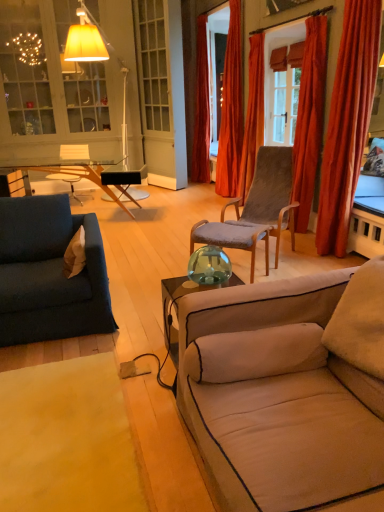
Find the location of `beige carpet at lower left`. beige carpet at lower left is located at coordinates (67, 439).

At what (x,y) coordinates should I click in order to perform the action: click on beige fabric pillow at left. Please return your answer as a coordinate pair (x, y). The width and height of the screenshot is (384, 512). Looking at the image, I should click on (75, 254).

Locate an element on the screen. velvet orange curtain at right, marked as the fifth curtain in a back-to-front arrangement is located at coordinates (348, 123).

Measure the distance between orange velvet curtain at center, which is the third curtain in front-to-back order, and camera.

They are 16.92 feet apart.

What do you see at coordinates (253, 115) in the screenshot? I see `orange velvet curtain at center, which is the third curtain in front-to-back order` at bounding box center [253, 115].

Find the location of a particular element. Image resolution: width=384 pixels, height=512 pixels. velvet orange curtain at upper right, which ranks as the fourth curtain in front-to-back order is located at coordinates (231, 110).

Locate an element on the screen. Image resolution: width=384 pixels, height=512 pixels. matte glass cabinet at upper left is located at coordinates (48, 73).

Considering the relative sizes of velvet orange curtain at upper right, arranged as the second curtain when viewed from the back, and velvet orange curtain at upper right, which is the fourth curtain from back to front, in the image provided, is velvet orange curtain at upper right, arranged as the second curtain when viewed from the back, taller than velvet orange curtain at upper right, which is the fourth curtain from back to front,?

Yes, velvet orange curtain at upper right, arranged as the second curtain when viewed from the back, is taller than velvet orange curtain at upper right, which is the fourth curtain from back to front.

Is velvet orange curtain at upper right, the 2th curtain positioned from the front, completely or partially inside velvet orange curtain at upper right, which ranks as the fourth curtain in front-to-back order?

Actually, velvet orange curtain at upper right, the 2th curtain positioned from the front, is outside velvet orange curtain at upper right, which ranks as the fourth curtain in front-to-back order.

Is velvet orange curtain at upper right, arranged as the second curtain when viewed from the back, next to velvet orange curtain at upper right, the 2th curtain positioned from the front, and touching it?

velvet orange curtain at upper right, arranged as the second curtain when viewed from the back, is not next to velvet orange curtain at upper right, the 2th curtain positioned from the front, and they're not touching.

How many degrees apart are the facing directions of velvet orange curtain at upper right, arranged as the second curtain when viewed from the back, and velvet orange curtain at upper right, which is the fourth curtain from back to front?

The angle between the facing direction of velvet orange curtain at upper right, arranged as the second curtain when viewed from the back, and the facing direction of velvet orange curtain at upper right, which is the fourth curtain from back to front, is 0.418 degrees.

Between beige fabric couch at lower right, which is the 1th studio couch from right to left, and velvet brown chair at center, which one has smaller width?

velvet brown chair at center is thinner.

Who is taller, beige fabric couch at lower right, which is the 1th studio couch from right to left, or velvet brown chair at center?

velvet brown chair at center is taller.

Who is bigger, beige fabric couch at lower right, acting as the second studio couch starting from the left, or velvet brown chair at center?

beige fabric couch at lower right, acting as the second studio couch starting from the left, is bigger.

Considering the positions of point (337, 407) and point (259, 234), is point (337, 407) closer or farther from the camera than point (259, 234)?

Point (337, 407) appears to be closer to the viewer than point (259, 234).

Between point (321, 65) and point (94, 182), which one is positioned in front?

Point (321, 65)

Is velvet orange curtain at upper right, which is the fourth curtain from back to front, positioned before wooden glass table at left?

Yes, the depth of velvet orange curtain at upper right, which is the fourth curtain from back to front, is less than that of wooden glass table at left.

Could you tell me if velvet orange curtain at upper right, the 2th curtain positioned from the front, is turned towards wooden glass table at left?

No, velvet orange curtain at upper right, the 2th curtain positioned from the front, is not turned towards wooden glass table at left.

Is velvet orange curtain at upper right, which is the fourth curtain from back to front, inside the boundaries of wooden glass table at left, or outside?

velvet orange curtain at upper right, which is the fourth curtain from back to front, exists outside the volume of wooden glass table at left.

Is velvet brown chair at center bigger or smaller than matte glass cabinet at upper left?

Clearly, velvet brown chair at center is smaller in size than matte glass cabinet at upper left.

Between velvet brown chair at center and matte glass cabinet at upper left, which one appears on the right side from the viewer's perspective?

From the viewer's perspective, velvet brown chair at center appears more on the right side.

Is the position of velvet brown chair at center more distant than that of matte glass cabinet at upper left?

No, the depth of velvet brown chair at center is less than that of matte glass cabinet at upper left.

Is velvet brown chair at center facing towards matte glass cabinet at upper left?

No, velvet brown chair at center is not turned towards matte glass cabinet at upper left.

Between wooden glass table at left and velvet orange curtain at right, marked as the fifth curtain in a back-to-front arrangement, which one has smaller width?

velvet orange curtain at right, marked as the fifth curtain in a back-to-front arrangement.

Is velvet orange curtain at right, marked as the fifth curtain in a back-to-front arrangement, at the back of wooden glass table at left?

No.

Does point (121, 204) come in front of point (347, 178)?

No, (121, 204) is further to viewer.

Can you tell me how much wooden glass table at left and velvet orange curtain at right, marked as the fifth curtain in a back-to-front arrangement, differ in facing direction?

There is a 110-degree angle between the facing directions of wooden glass table at left and velvet orange curtain at right, marked as the fifth curtain in a back-to-front arrangement.

Choose the correct answer: Is clear glass window at center inside matte black armchair at center or outside it?

clear glass window at center is located beyond the bounds of matte black armchair at center.

Is point (165, 108) closer or farther from the camera than point (69, 181)?

Point (165, 108) appears to be farther away from the viewer than point (69, 181).

Is clear glass window at center thinner than matte black armchair at center?

Yes, clear glass window at center is thinner than matte black armchair at center.

From the image's perspective, is velvet blue couch at left, which is the 1th studio couch in back-to-front order, below beige fabric pillow at left?

Correct, velvet blue couch at left, which is the 1th studio couch in back-to-front order, appears lower than beige fabric pillow at left in the image.

Based on the photo, does velvet blue couch at left, which is the 1th studio couch in back-to-front order, turn towards beige fabric pillow at left?

Yes, velvet blue couch at left, which is the 1th studio couch in back-to-front order, is turned towards beige fabric pillow at left.

How many degrees apart are the facing directions of velvet blue couch at left, which appears as the 2th studio couch when viewed from the front, and beige fabric pillow at left?

The facing directions of velvet blue couch at left, which appears as the 2th studio couch when viewed from the front, and beige fabric pillow at left are 90 degrees apart.

Which of these two, velvet blue couch at left, which ranks as the 2th studio couch in right-to-left order, or beige fabric pillow at left, is smaller?

beige fabric pillow at left.

There is a velvet orange curtain at upper right, the 2th curtain positioned from the front. At what (x,y) coordinates should I click in order to perform the action: click on the 2nd curtain below it (from a real-world perspective). Please return your answer as a coordinate pair (x, y). The height and width of the screenshot is (512, 384). Looking at the image, I should click on (231, 110).

The height and width of the screenshot is (512, 384). Find the location of `chair on the right of beige fabric couch at lower right, which is counted as the first studio couch, starting from the front`. chair on the right of beige fabric couch at lower right, which is counted as the first studio couch, starting from the front is located at coordinates (257, 209).

Considering their positions, is beige fabric couch at lower right, which is the 1th studio couch from right to left, positioned further to velvet brown chair at center than matte black armchair at center?

matte black armchair at center lies further to velvet brown chair at center than the other object.

When comparing their distances from velvet orange curtain at right, marked as the fifth curtain in a back-to-front arrangement, does velvet brown chair at center or orange velvet curtain at center, placed as the 3th curtain when sorted from back to front, seem further?

Based on the image, orange velvet curtain at center, placed as the 3th curtain when sorted from back to front, appears to be further to velvet orange curtain at right, marked as the fifth curtain in a back-to-front arrangement.

Looking at the image, which one is located closer to transparent glass vase at center, matte glass cabinet at upper left or clear glass window at center?

Based on the image, clear glass window at center appears to be nearer to transparent glass vase at center.

Based on their spatial positions, is velvet orange curtain at center, which is counted as the 1th curtain, starting from the back, or velvet orange curtain at upper right, which ranks as the fourth curtain in front-to-back order, closer to wooden glass table at left?

The object closer to wooden glass table at left is velvet orange curtain at center, which is counted as the 1th curtain, starting from the back.

From the image, which object appears to be nearer to velvet orange curtain at right, marked as the fifth curtain in a back-to-front arrangement, velvet brown chair at center or matte black armchair at center?

The object closer to velvet orange curtain at right, marked as the fifth curtain in a back-to-front arrangement, is velvet brown chair at center.

Estimate the real-world distances between objects in this image. Which object is closer to wooden glass table at left, velvet orange curtain at right, which appears as the 1th curtain when viewed from the front, or matte glass cabinet at upper left?

Based on the image, matte glass cabinet at upper left appears to be nearer to wooden glass table at left.

Considering their positions, is transparent glass vase at center positioned closer to velvet brown chair at center than matte glass cabinet at upper left?

Based on the image, transparent glass vase at center appears to be nearer to velvet brown chair at center.

Looking at the image, which one is located closer to velvet brown chair at center, velvet orange curtain at upper right, which is the fourth curtain from back to front, or beige carpet at lower left?

The object closer to velvet brown chair at center is velvet orange curtain at upper right, which is the fourth curtain from back to front.

The width and height of the screenshot is (384, 512). Identify the location of studio couch located between transparent glass vase at center and velvet orange curtain at upper right, arranged as the second curtain when viewed from the back, in the depth direction. (49, 273).

Locate an element on the screen. window located between velvet orange curtain at upper right, which is the fourth curtain from back to front, and velvet orange curtain at center, which is counted as the 1th curtain, starting from the back, in the depth direction is located at coordinates (153, 65).

The height and width of the screenshot is (512, 384). Identify the location of armchair located between beige carpet at lower left and velvet orange curtain at center, which is counted as the 1th curtain, starting from the back, in the depth direction. (74, 152).

Where is `cabinetry between transparent glass vase at center and matte black armchair at center from front to back`? The width and height of the screenshot is (384, 512). cabinetry between transparent glass vase at center and matte black armchair at center from front to back is located at coordinates (48, 73).